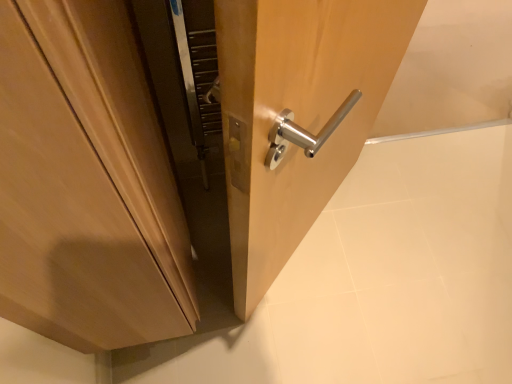
Identify the location of polished silver handle at center. This screenshot has height=384, width=512. 310,118.

Image resolution: width=512 pixels, height=384 pixels. What do you see at coordinates (310, 118) in the screenshot?
I see `polished silver handle at center` at bounding box center [310, 118].

You are a GUI agent. You are given a task and a screenshot of the screen. Output one action in this format:
    pyautogui.click(x=<x>, y=<y>)
    Task: Click on the polished silver handle at center
    This screenshot has width=512, height=384.
    Given the screenshot: What is the action you would take?
    pyautogui.click(x=310, y=118)